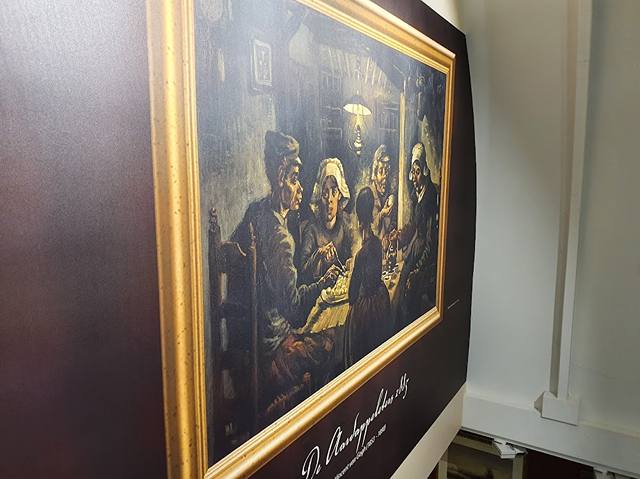
Image resolution: width=640 pixels, height=479 pixels. What are the coordinates of `top black area of pendant light` in the screenshot? It's located at (356, 99).